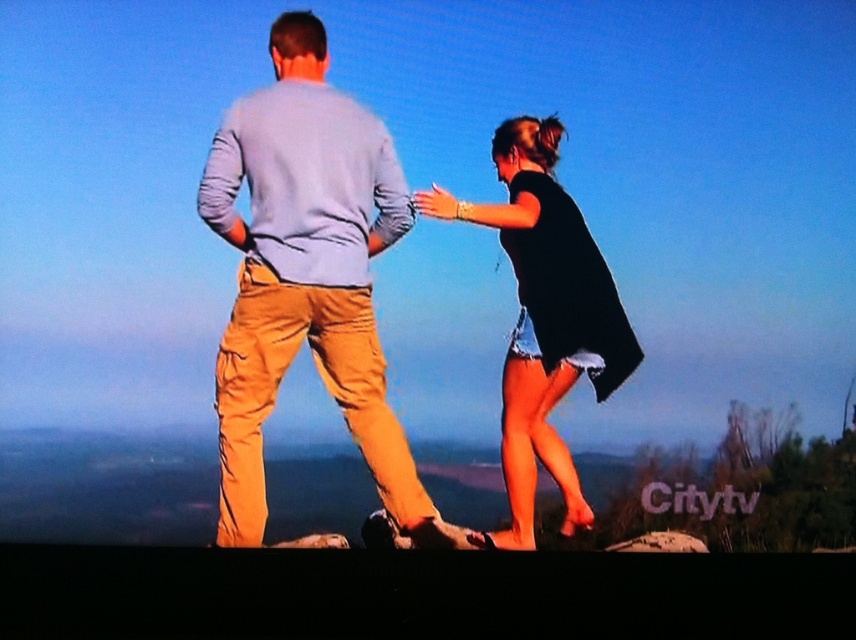
Looking at this image, does black cotton dress at center have a greater width compared to orange leather glove at center?

Indeed, black cotton dress at center has a greater width compared to orange leather glove at center.

Who is higher up, black cotton dress at center or orange leather glove at center?

Positioned higher is orange leather glove at center.

Is point (587, 236) closer to viewer compared to point (429, 212)?

No, it is not.

The height and width of the screenshot is (640, 856). In order to click on black cotton dress at center in this screenshot , I will do `click(547, 323)`.

Does light blue cotton shirt at center have a lesser width compared to orange leather glove at center?

No, light blue cotton shirt at center is not thinner than orange leather glove at center.

Which is in front, point (278, 298) or point (455, 202)?

Point (278, 298) is in front.

Which is behind, point (321, 339) or point (447, 209)?

Positioned behind is point (447, 209).

The height and width of the screenshot is (640, 856). Identify the location of light blue cotton shirt at center. (307, 276).

Between point (296, 221) and point (617, 304), which one is positioned in front?

Positioned in front is point (296, 221).

Does point (349, 308) come closer to viewer compared to point (547, 304)?

Yes, point (349, 308) is closer to viewer.

Does point (262, 243) come behind point (572, 244)?

No, it is in front of (572, 244).

Identify the location of light blue cotton shirt at center. Image resolution: width=856 pixels, height=640 pixels. (307, 276).